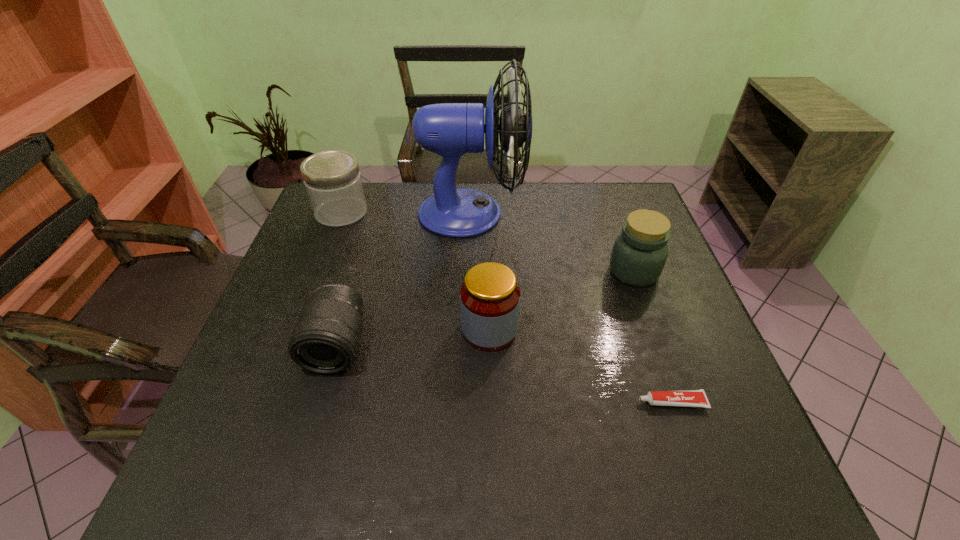
This screenshot has height=540, width=960. Identify the location of free space between the farthest jar and the tallest object. (406, 213).

At what (x,y) coordinates should I click in order to perform the action: click on vacant point located between the farthest jar and the fourth nearest object. Please return your answer as a coordinate pair (x, y). The height and width of the screenshot is (540, 960). Looking at the image, I should click on (488, 242).

I want to click on vacant area that lies between the tallest object and the shortest object, so click(571, 307).

You are a GUI agent. You are given a task and a screenshot of the screen. Output one action in this format:
    pyautogui.click(x=<x>, y=<y>)
    Task: Click on the vacant point located between the farthest jar and the telephoto lens
    This screenshot has width=960, height=540.
    Given the screenshot: What is the action you would take?
    pyautogui.click(x=339, y=279)

This screenshot has width=960, height=540. In order to click on free space between the second farthest jar and the nearest jar in this screenshot , I will do `click(562, 301)`.

Find the location of a particular element. The width and height of the screenshot is (960, 540). unoccupied position between the fifth tallest object and the second jar from right to left is located at coordinates (413, 338).

Image resolution: width=960 pixels, height=540 pixels. In order to click on free space between the farthest jar and the second farthest jar in this screenshot , I will do `click(488, 242)`.

Identify which object is the third closest to the shortest object. Please provide its 2D coordinates. Your answer should be formatted as a tuple, i.e. [(x, y)], where the tuple contains the x and y coordinates of a point satisfying the conditions above.

[(450, 130)]

Image resolution: width=960 pixels, height=540 pixels. What are the coordinates of `object that ranks as the closest to the nearest jar` in the screenshot? It's located at (325, 340).

Find the location of a particular element. The image size is (960, 540). jar identified as the second closest to the second jar from left to right is located at coordinates (332, 178).